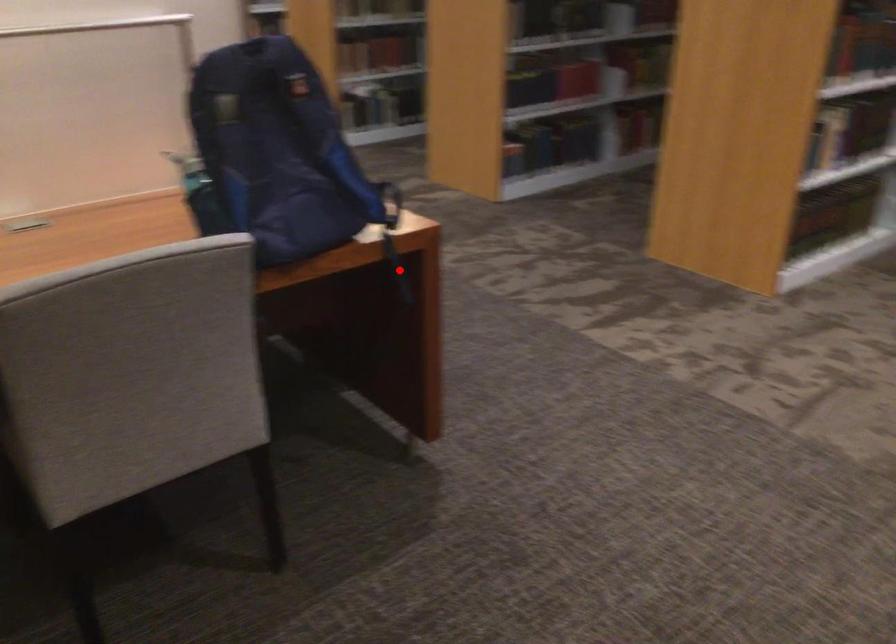
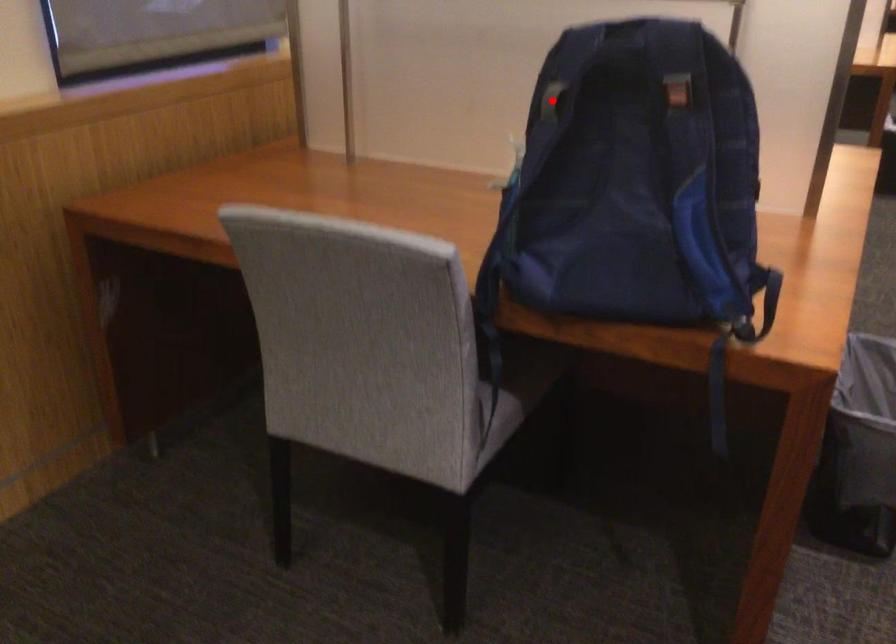
I am providing you with two images of the same scene from different viewpoints. A red point is marked on the first image and another point is marked on the second image. Is the marked point in image1 the same physical position as the marked point in image2?

No